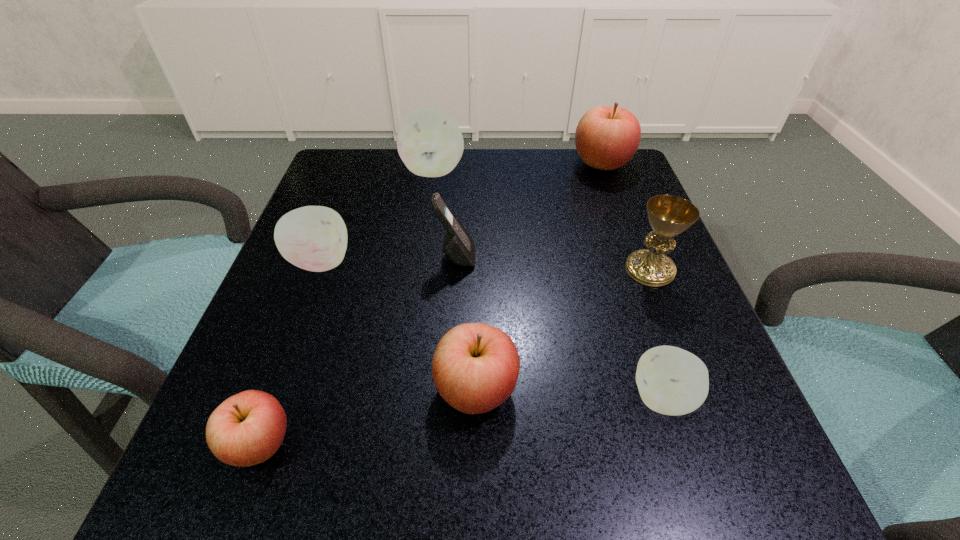
Locate an element on the screen. This screenshot has width=960, height=540. object that can be found as the fifth closest to the leftmost red apple is located at coordinates (429, 142).

I want to click on apple object that ranks as the fourth closest to the nearest white apple, so click(606, 138).

Locate an element on the screen. This screenshot has height=540, width=960. apple that is the second closest one to the rightmost white apple is located at coordinates (246, 429).

The width and height of the screenshot is (960, 540). In order to click on white apple that is the second closest to the chalice in this screenshot , I will do `click(429, 142)`.

Where is `white apple that can be found as the closest to the leftmost white apple`? white apple that can be found as the closest to the leftmost white apple is located at coordinates click(429, 142).

Choose which red apple is the second nearest neighbor to the nearest white apple. Please provide its 2D coordinates. Your answer should be formatted as a tuple, i.e. [(x, y)], where the tuple contains the x and y coordinates of a point satisfying the conditions above.

[(246, 429)]

I want to click on the closest red apple to the leftmost red apple, so click(x=475, y=367).

Find the location of `blank space that satisfies the following two spatial constraints: 1. on the front-facing side of the second red apple from left to right; 2. on the left side of the cellular telephone`. blank space that satisfies the following two spatial constraints: 1. on the front-facing side of the second red apple from left to right; 2. on the left side of the cellular telephone is located at coordinates (448, 389).

The height and width of the screenshot is (540, 960). I want to click on vacant space that satisfies the following two spatial constraints: 1. on the front side of the second red apple from left to right; 2. on the left side of the farthest white apple, so click(403, 389).

Find the location of a particular element. This screenshot has height=540, width=960. free space that satisfies the following two spatial constraints: 1. on the front-facing side of the second red apple from left to right; 2. on the left side of the cellular telephone is located at coordinates (448, 389).